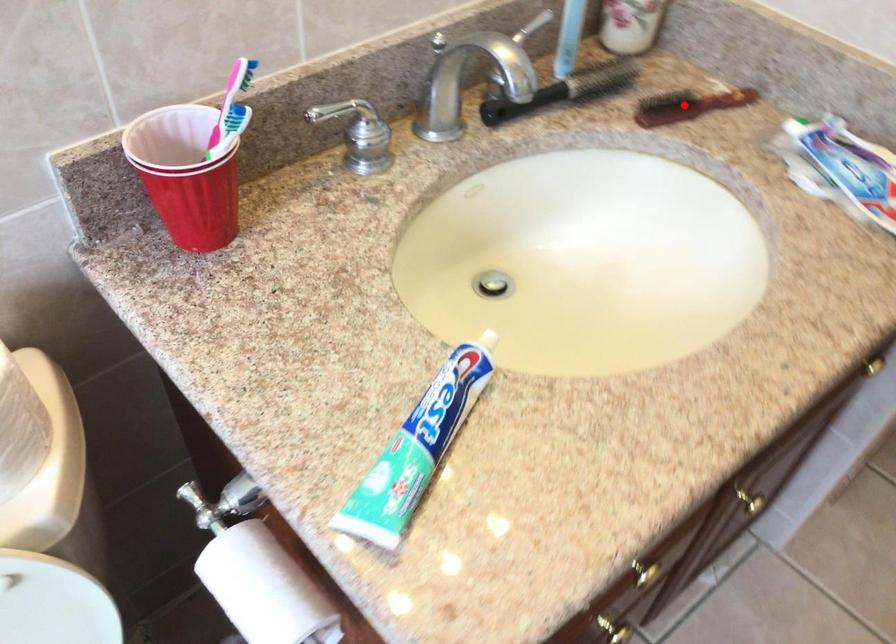
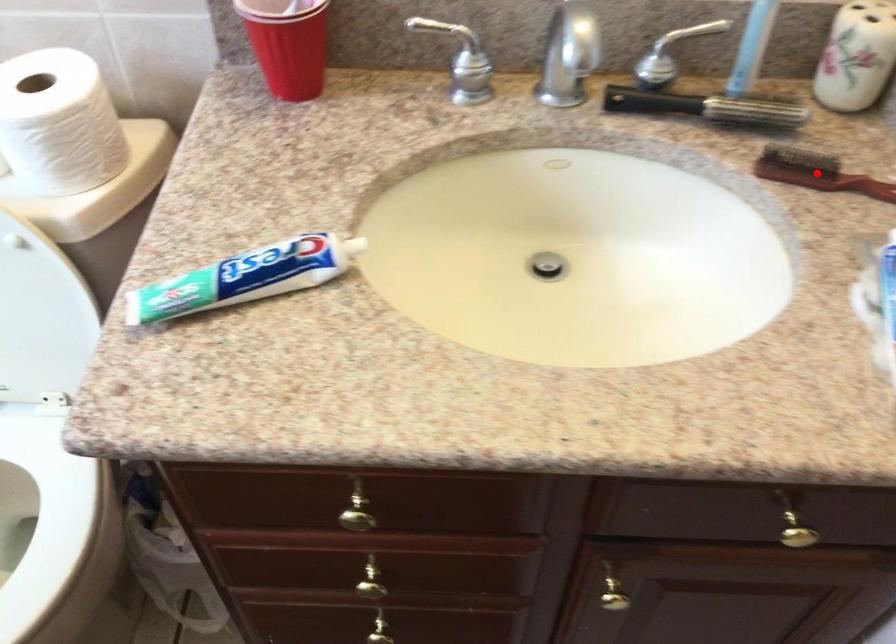
I am providing you with two images of the same scene from different viewpoints. A red point is marked on the first image and another point is marked on the second image. Do the highlighted points in image1 and image2 indicate the same real-world spot?

Yes